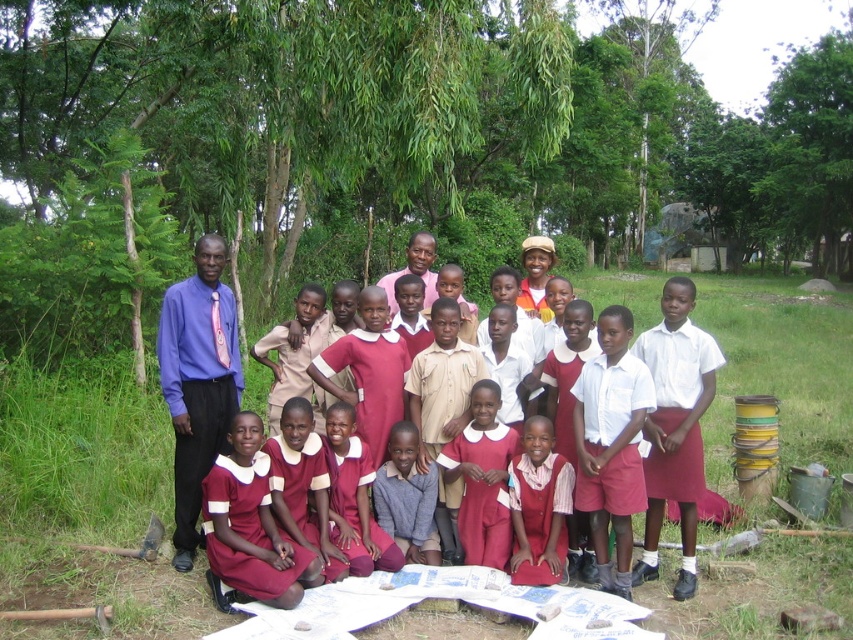
You are a photographer trying to capture a clear shot of the white cotton shirt at center without the green leafy tree at upper center blocking it. Based on their sizes, which object would you need to adjust your camera angle to avoid?

The green leafy tree at upper center is larger in size than the white cotton shirt at center, so you would need to adjust your camera angle to avoid the green leafy tree at upper center blocking the view of the white cotton shirt at center.

You are a photographer taking a picture of the maroon dress at center and the green leafy tree at center. Which object is positioned higher in the image?

The green leafy tree at center is positioned higher than the maroon dress at center in the image.